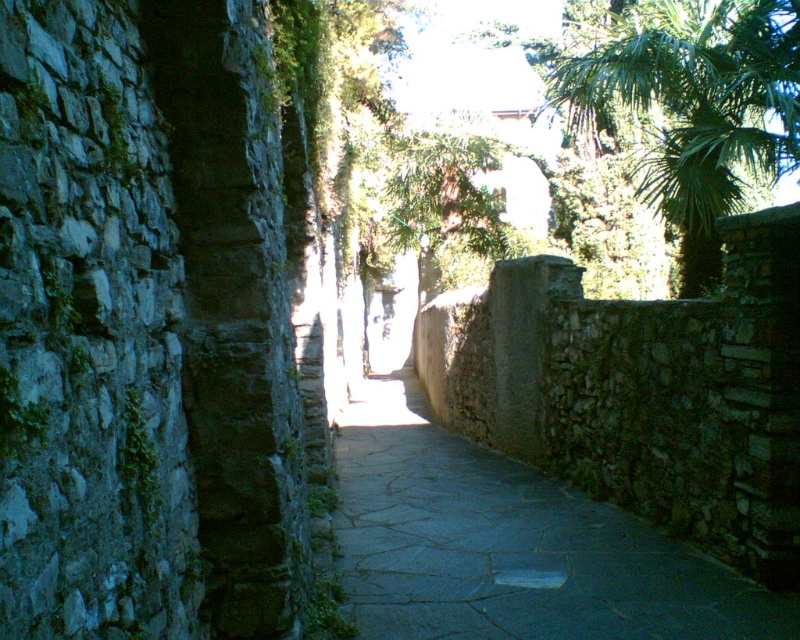
From the picture: You are standing at the entrance of the dark stone path at center and want to reach the sunlit area at the end. Which direction should you walk to avoid the green leafy palm tree at upper right?

The dark stone path at center is in front of the green leafy palm tree at upper right, so you should walk straight along the path to reach the sunlit area without encountering the palm tree.

From the picture: You are standing at the entrance of a narrow stone path and see the dark stone path at center and the green leafy palm tree at upper right. Which object appears larger in the image?

The green leafy palm tree at upper right appears larger than the dark stone path at center in the image.